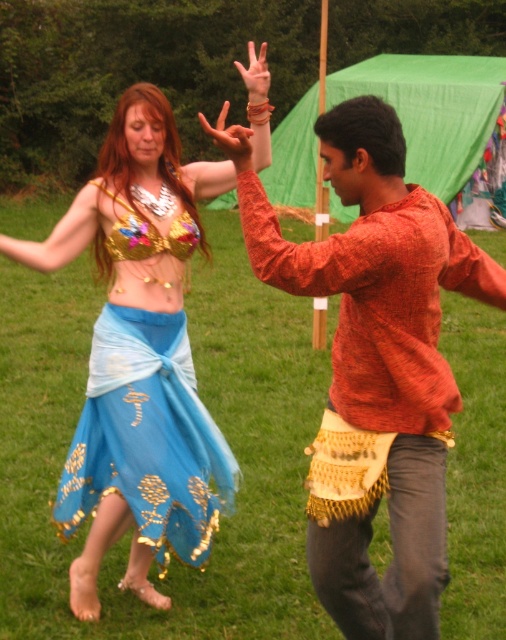
Between point (17, 333) and point (146, 288), which one is positioned in front?

Positioned in front is point (146, 288).

Does green grass at center appear over matte gold bra at center?

Indeed, green grass at center is positioned over matte gold bra at center.

Which is behind, point (472, 458) or point (143, 212)?

Positioned behind is point (472, 458).

Locate an element on the screen. green grass at center is located at coordinates (217, 422).

Does point (224, 518) come behind point (442, 419)?

That is True.

Where is `green grass at center`? green grass at center is located at coordinates (217, 422).

Which is behind, point (185, 392) or point (188, 243)?

Point (188, 243)

Which is more to the right, matte gold bra at center or blue sheer skirt at left?

Positioned to the right is matte gold bra at center.

The image size is (506, 640). Describe the element at coordinates (140, 358) in the screenshot. I see `matte gold bra at center` at that location.

You are a GUI agent. You are given a task and a screenshot of the screen. Output one action in this format:
    pyautogui.click(x=<x>, y=<y>)
    Task: Click on the matte gold bra at center
    
    Given the screenshot: What is the action you would take?
    pyautogui.click(x=140, y=358)